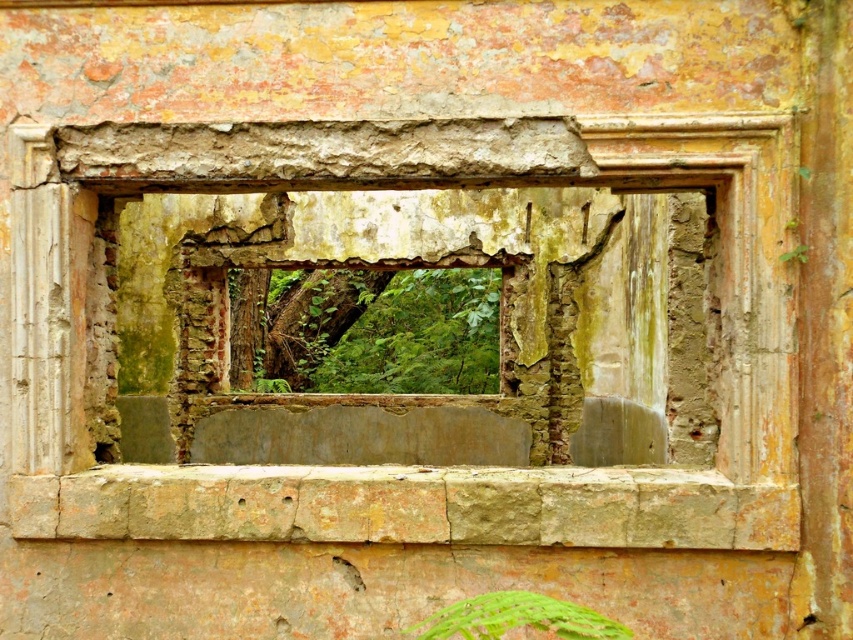
Measure the distance between green leafy tree at center and green leafy plant at lower center.

11.66 meters

Can you confirm if green leafy tree at center is wider than green leafy plant at lower center?

Yes.

The image size is (853, 640). Describe the element at coordinates (374, 332) in the screenshot. I see `green leafy tree at center` at that location.

Identify the location of green leafy tree at center. Image resolution: width=853 pixels, height=640 pixels. (374, 332).

Is rusty concrete window frame at center below green leafy tree at center?

Yes, rusty concrete window frame at center is below green leafy tree at center.

Which is more to the right, rusty concrete window frame at center or green leafy tree at center?

Positioned to the right is rusty concrete window frame at center.

Identify the location of rusty concrete window frame at center. (393, 266).

Can you confirm if rusty concrete window frame at center is positioned to the right of green leafy plant at lower center?

Incorrect, rusty concrete window frame at center is not on the right side of green leafy plant at lower center.

Measure the distance between point (316,168) and camera.

They are 5.75 meters apart.

What are the coordinates of `rusty concrete window frame at center` in the screenshot? It's located at (x=393, y=266).